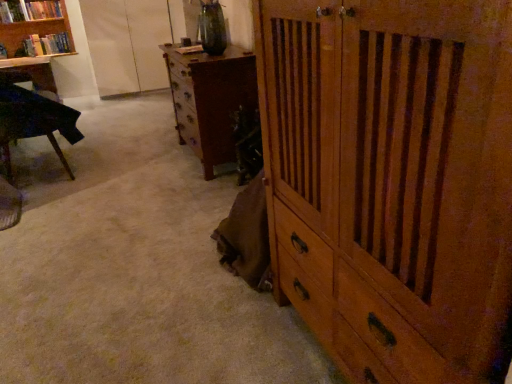
Question: Looking at the image, does black glossy table at left seem bigger or smaller compared to brown wooden chest of drawers at center, placed as the 1th chest of drawers when sorted from back to front?

Choices:
 (A) big
 (B) small

Answer: (A)

Question: From the image's perspective, relative to brown wooden chest of drawers at center, arranged as the first chest of drawers when viewed from the left, is black glossy table at left above or below?

Choices:
 (A) above
 (B) below

Answer: (B)

Question: Which object is the closest to the white fabric screen door at upper left?

Choices:
 (A) brown wooden chest of drawers at center, placed as the 1th chest of drawers when sorted from back to front
 (B) hardcover book at upper left, arranged as the second book when ordered from the bottom
 (C) matte black desk at left
 (D) wooden bookshelf at upper left
 (E) wooden cabinet at center, positioned as the first chest of drawers in right-to-left order

Answer: (D)

Question: Estimate the real-world distances between objects in this image. Which object is closer to the matte black desk at left?

Choices:
 (A) hardcover book at upper left, the 1th book when ordered from bottom to top
 (B) white fabric screen door at upper left
 (C) wooden cabinet at center, marked as the second chest of drawers in a left-to-right arrangement
 (D) wooden bookshelf at upper left
 (E) brown wooden chest of drawers at center, placed as the 1th chest of drawers when sorted from back to front

Answer: (A)